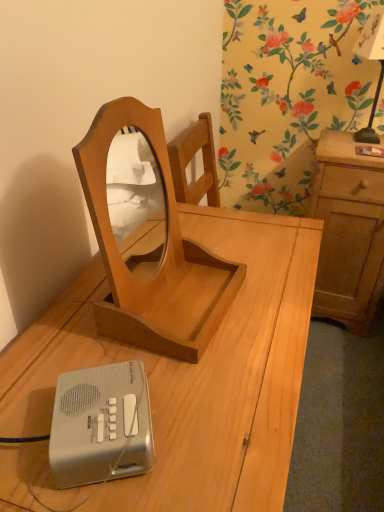
Where is `vacant point to the right of silver plastic ipod at lower left`? This screenshot has width=384, height=512. vacant point to the right of silver plastic ipod at lower left is located at coordinates (216, 419).